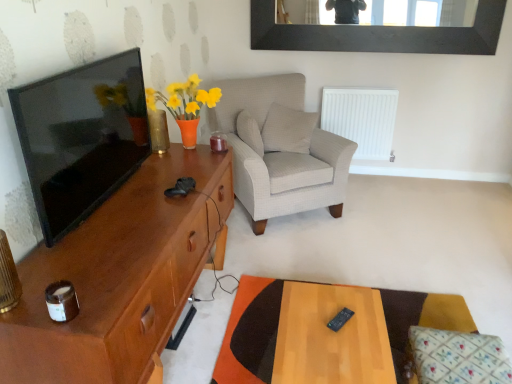
Question: Is translucent glass vase at left not within black plastic remote at center?

Choices:
 (A) yes
 (B) no

Answer: (A)

Question: Considering the relative positions of translucent glass vase at left and black plastic remote at center in the image provided, is translucent glass vase at left to the left of black plastic remote at center from the viewer's perspective?

Choices:
 (A) yes
 (B) no

Answer: (A)

Question: Is translucent glass vase at left oriented away from black plastic remote at center?

Choices:
 (A) yes
 (B) no

Answer: (B)

Question: Is the surface of translucent glass vase at left in direct contact with black plastic remote at center?

Choices:
 (A) no
 (B) yes

Answer: (A)

Question: Is translucent glass vase at left smaller than black plastic remote at center?

Choices:
 (A) no
 (B) yes

Answer: (A)

Question: Can you confirm if translucent glass vase at left is shorter than black plastic remote at center?

Choices:
 (A) yes
 (B) no

Answer: (B)

Question: Is white textured pillow at center, arranged as the 2th pillow when viewed from the front, facing towards floral fabric cushion at lower right, placed as the 3th pillow when sorted from back to front?

Choices:
 (A) no
 (B) yes

Answer: (A)

Question: Is white textured pillow at center, positioned as the 1th pillow in left-to-right order, at the right side of floral fabric cushion at lower right, the 1th pillow when ordered from bottom to top?

Choices:
 (A) no
 (B) yes

Answer: (A)

Question: Considering the relative sizes of white textured pillow at center, which is counted as the 2th pillow, starting from the bottom, and floral fabric cushion at lower right, marked as the third pillow in a top-to-bottom arrangement, in the image provided, is white textured pillow at center, which is counted as the 2th pillow, starting from the bottom, shorter than floral fabric cushion at lower right, marked as the third pillow in a top-to-bottom arrangement,?

Choices:
 (A) no
 (B) yes

Answer: (A)

Question: Does white textured pillow at center, positioned as the 1th pillow in left-to-right order, come behind floral fabric cushion at lower right, placed as the 3th pillow when sorted from back to front?

Choices:
 (A) yes
 (B) no

Answer: (A)

Question: From a real-world perspective, is white textured pillow at center, positioned as the second pillow in top-to-bottom order, positioned over floral fabric cushion at lower right, placed as the 3th pillow when sorted from back to front, based on gravity?

Choices:
 (A) no
 (B) yes

Answer: (B)

Question: Is white textured pillow at center, arranged as the 2th pillow when viewed from the front, placed right next to floral fabric cushion at lower right, the 1th pillow in the right-to-left sequence?

Choices:
 (A) yes
 (B) no

Answer: (B)

Question: Is black plastic remote at center placed right next to white plastic radiator at center right?

Choices:
 (A) no
 (B) yes

Answer: (A)